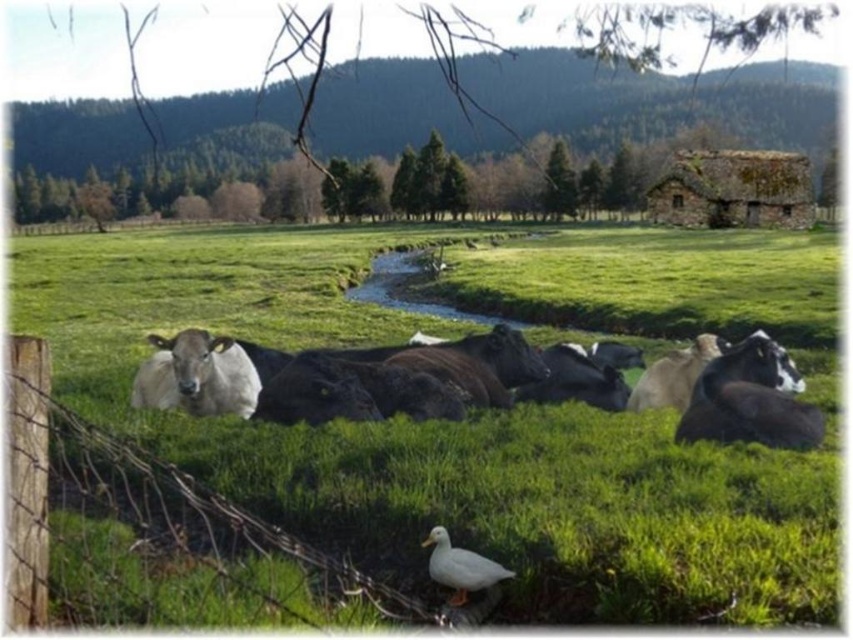
You are a farmer checking the field and notice the wooden post at lower left and the white glossy cow at center. Which object is positioned more to the left side of the image?

The wooden post at lower left is positioned to the left of the white glossy cow at center, so it is more to the left side of the image.